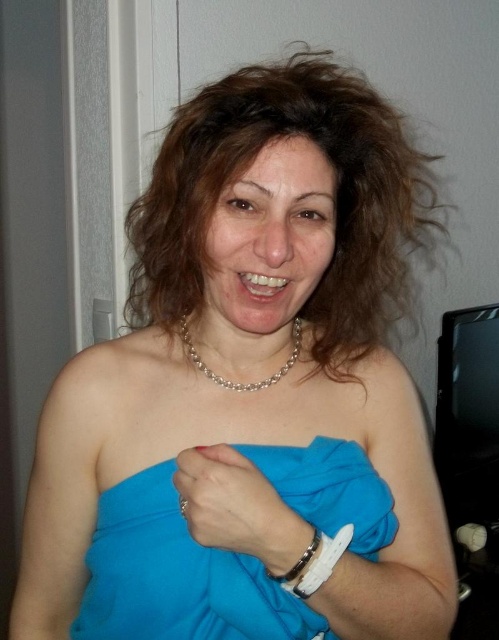
Does brown curly hair at upper center come in front of silver metallic bracelet at wrist?

That is False.

Is brown curly hair at upper center shorter than silver metallic bracelet at wrist?

No.

Which is in front, point (172, 124) or point (290, 566)?

Point (290, 566) is in front.

This screenshot has width=499, height=640. Find the location of `brown curly hair at upper center`. brown curly hair at upper center is located at coordinates (335, 200).

Is blue satin dress at center to the left of silver metallic bracelet at wrist from the viewer's perspective?

Indeed, blue satin dress at center is positioned on the left side of silver metallic bracelet at wrist.

The image size is (499, 640). Identify the location of blue satin dress at center. (177, 577).

Is white leather bracelet at lower center wider than silver metallic bracelet at wrist?

Yes, white leather bracelet at lower center is wider than silver metallic bracelet at wrist.

Is white leather bracelet at lower center positioned in front of silver metallic bracelet at wrist?

Yes, white leather bracelet at lower center is closer to the viewer.

Between point (344, 547) and point (297, 564), which one is positioned in front?

Positioned in front is point (297, 564).

The image size is (499, 640). Identify the location of white leather bracelet at lower center. (323, 561).